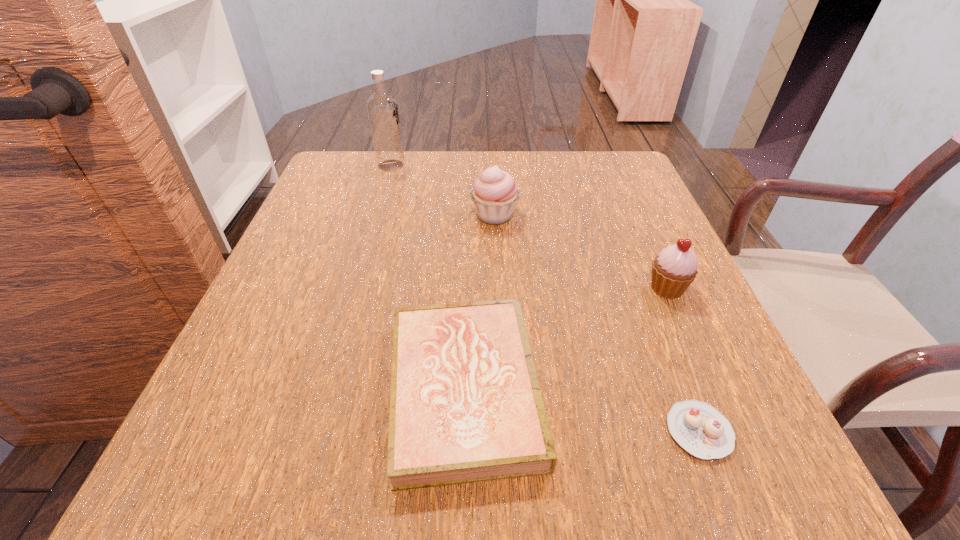
At what (x,y) coordinates should I click in order to perform the action: click on free space that satisfies the following two spatial constraints: 1. on the front label of the third nearest object; 2. on the right side of the tallest object. Please return your answer as a coordinate pair (x, y). The image size is (960, 540). Looking at the image, I should click on (354, 288).

Find the location of a particular element. vacant region that satisfies the following two spatial constraints: 1. on the front label of the tallest object; 2. on the left side of the second farthest object is located at coordinates (376, 215).

At what (x,y) coordinates should I click in order to perform the action: click on vacant space that satisfies the following two spatial constraints: 1. on the front label of the leftmost object; 2. on the left side of the shortest cupcake. Please return your answer as a coordinate pair (x, y). Looking at the image, I should click on (312, 431).

The height and width of the screenshot is (540, 960). I want to click on vacant point that satisfies the following two spatial constraints: 1. on the back side of the shortest object; 2. on the right side of the third nearest object, so pos(643,288).

What are the coordinates of `vacant space that satisfies the following two spatial constraints: 1. on the front label of the leftmost object; 2. on the right side of the shortest cupcake` in the screenshot? It's located at (312, 431).

Locate an element on the screen. This screenshot has height=540, width=960. free location that satisfies the following two spatial constraints: 1. on the front label of the leftmost cupcake; 2. on the right side of the tallest object is located at coordinates (376, 215).

Identify the location of free point that satisfies the following two spatial constraints: 1. on the back side of the second nearest cupcake; 2. on the front label of the tallest object. The width and height of the screenshot is (960, 540). (612, 165).

Identify the location of free spot that satisfies the following two spatial constraints: 1. on the front label of the fourth tallest object; 2. on the right side of the leftmost object. (324, 389).

The height and width of the screenshot is (540, 960). Find the location of `free spot that satisfies the following two spatial constraints: 1. on the back side of the third nearest object; 2. on the right side of the fourth tallest object`. free spot that satisfies the following two spatial constraints: 1. on the back side of the third nearest object; 2. on the right side of the fourth tallest object is located at coordinates (468, 288).